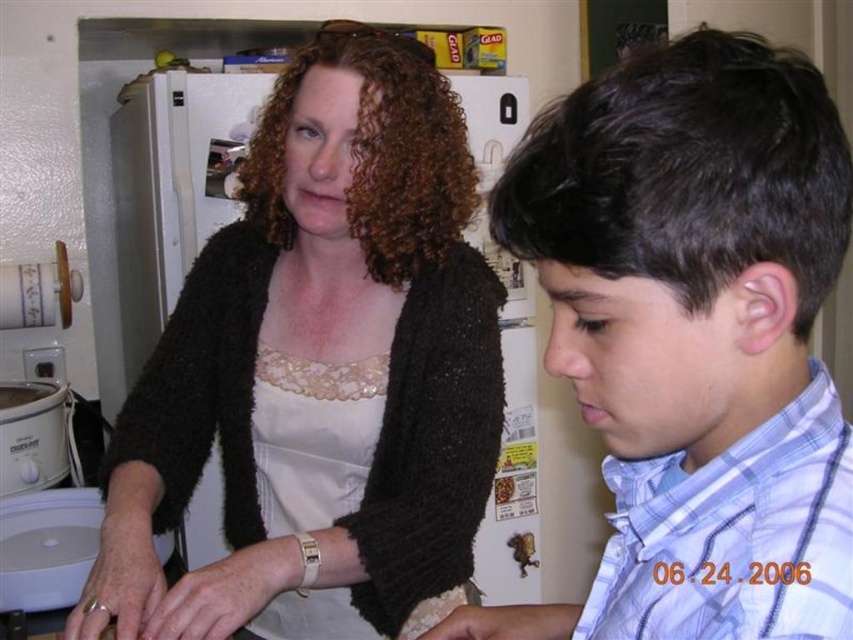
Question: Which point is farther to the camera?

Choices:
 (A) blue plaid shirt at center
 (B) black fuzzy sweater at upper left

Answer: (B)

Question: Which point appears closest to the camera in this image?

Choices:
 (A) (634, 552)
 (B) (355, 305)

Answer: (A)

Question: Is black fuzzy sweater at upper left in front of blue plaid shirt at center?

Choices:
 (A) yes
 (B) no

Answer: (B)

Question: Does black fuzzy sweater at upper left have a lesser width compared to blue plaid shirt at center?

Choices:
 (A) yes
 (B) no

Answer: (B)

Question: Can you confirm if black fuzzy sweater at upper left is smaller than blue plaid shirt at center?

Choices:
 (A) yes
 (B) no

Answer: (B)